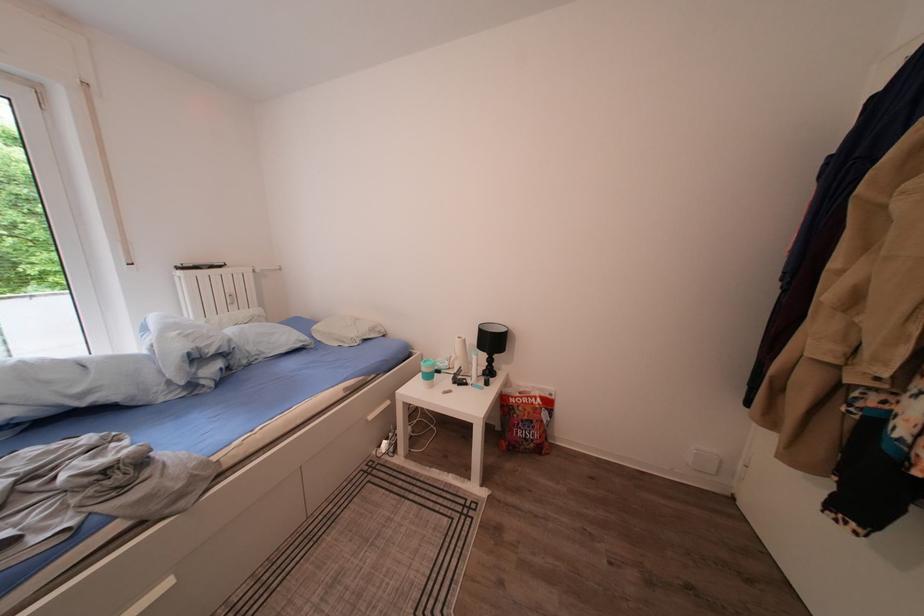
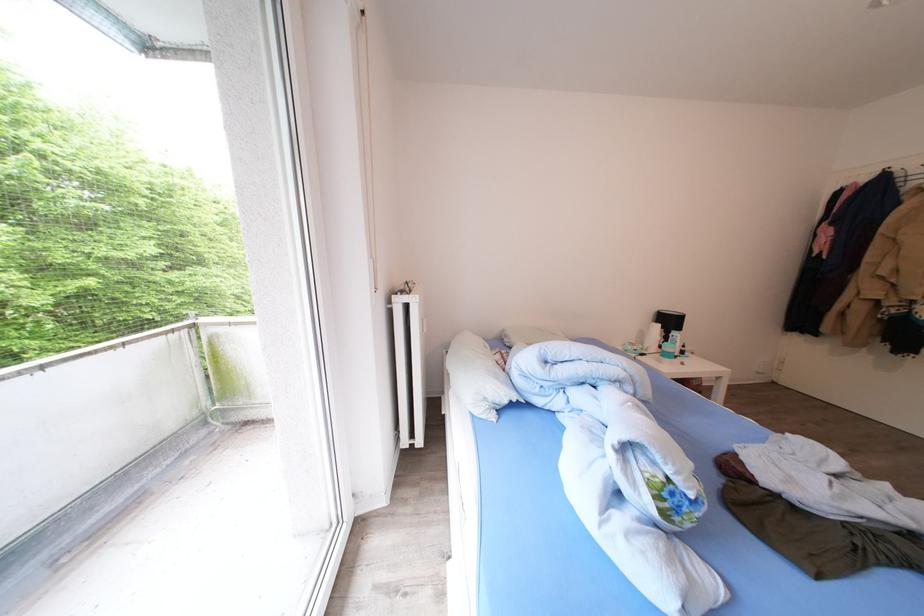
Question: Which direction would the cameraman need to move to produce the second image? Reply with the corresponding letter.

Choices:
 (A) Left
 (B) Right
 (C) Forward
 (D) Backward

Answer: (A)